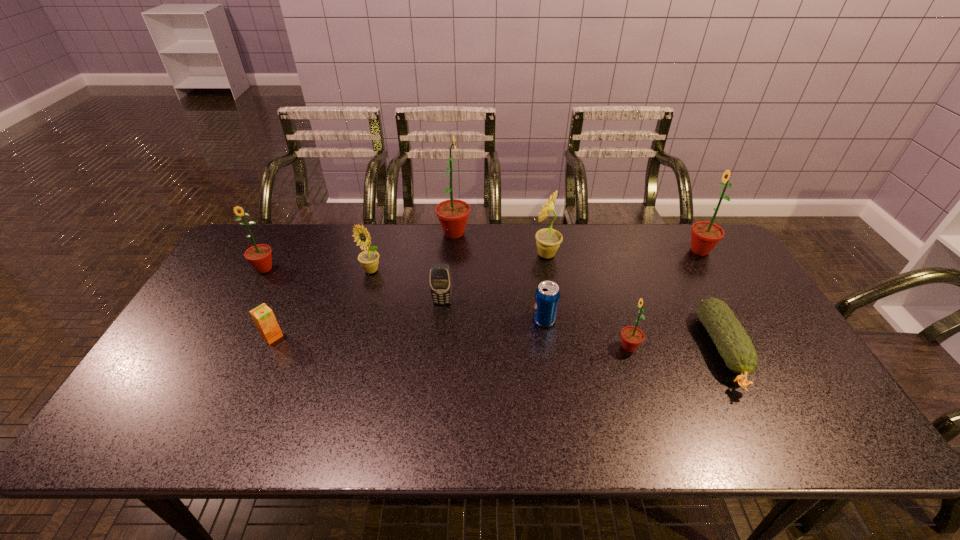
You are a GUI agent. You are given a task and a screenshot of the screen. Output one action in this format:
    pyautogui.click(x=<x>, y=<y>)
    Task: Click on the vacant space at the left edge of the desktop
    This screenshot has width=960, height=540.
    Given the screenshot: What is the action you would take?
    click(x=182, y=396)

Identify the location of vacant region at the right edge of the desktop. Image resolution: width=960 pixels, height=540 pixels. (739, 287).

Find the location of a particular element. free region at the near right corner is located at coordinates (804, 429).

At what (x,y) coordinates should I click in order to perform the action: click on free space between the fifth sunflower from right to left and the pop soda. Please return your answer as a coordinate pair (x, y). Image resolution: width=960 pixels, height=540 pixels. Looking at the image, I should click on (458, 295).

Locate an element on the screen. The width and height of the screenshot is (960, 540). vacant region between the third object from right to left and the second nearest green sunflower is located at coordinates (446, 308).

Find the location of a particular element. This screenshot has height=540, width=960. free space between the cellular telephone and the second tallest object is located at coordinates (571, 276).

Identify the location of empty location between the fifth nearest object and the second object from right to left. pyautogui.click(x=583, y=327).

You are a GUI agent. You are given a task and a screenshot of the screen. Output one action in this format:
    pyautogui.click(x=<x>, y=<y>)
    Task: Click on the vacant area that lies between the third green sunflower from left to right and the orange juice
    
    Given the screenshot: What is the action you would take?
    pyautogui.click(x=450, y=342)

This screenshot has width=960, height=540. Find the location of `blank region between the bigger yellow sunflower and the smallest green sunflower`. blank region between the bigger yellow sunflower and the smallest green sunflower is located at coordinates (588, 301).

You are a GUI agent. You are given a task and a screenshot of the screen. Output one action in this format:
    pyautogui.click(x=<x>, y=<y>)
    Task: Click on the free area in between the cellular telephone and the rightmost object
    Image resolution: width=960 pixels, height=540 pixels.
    Given the screenshot: What is the action you would take?
    pyautogui.click(x=571, y=276)